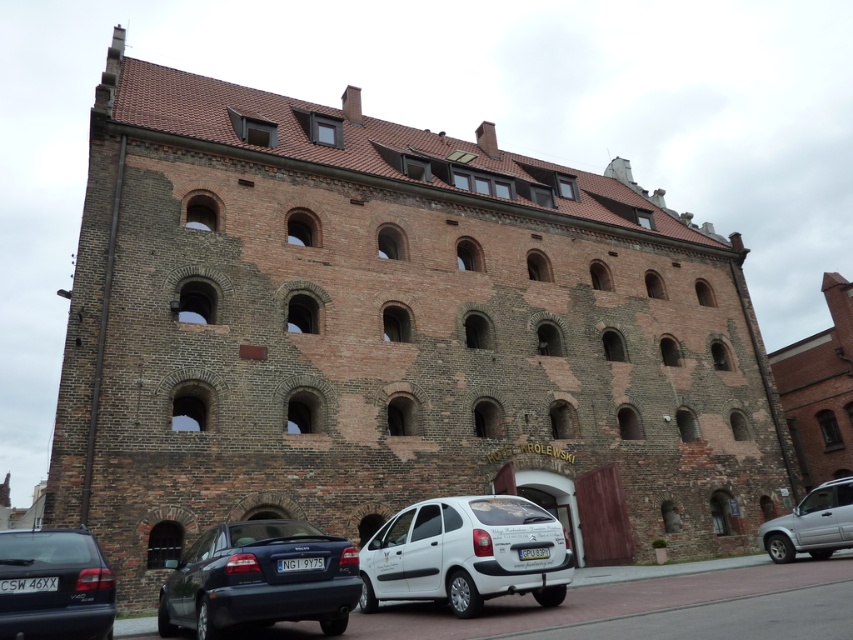
You are standing at the entrance of Hotel Krolewski and need to park your car. The parking lot is located at the back of the building. Can you see the white matte hatchback at center from the entrance?

The white matte hatchback at center is located at point (466, 554), which is not visible from the entrance as it is positioned at the back of the building where the parking lot is located.

Based on the photo, you are a delivery driver who needs to park your truck, which is 2 meters wide, in the parking lot near the Hotel Krolewski. You see a white matte hatchback at center and a silver metallic suv at lower right. Which vehicle has enough space between them for your truck to fit?

The white matte hatchback at center has a greater width than the silver metallic suv at lower right. Therefore, the space between them may accommodate the truck, but since the description only mentions their widths and not the distance between them, it is uncertain. However, if the truck is 2 meters wide and the hatchback is wider, it might have sufficient space. But without knowing the exact distance between the vehicles, we cannot confirm for sure.